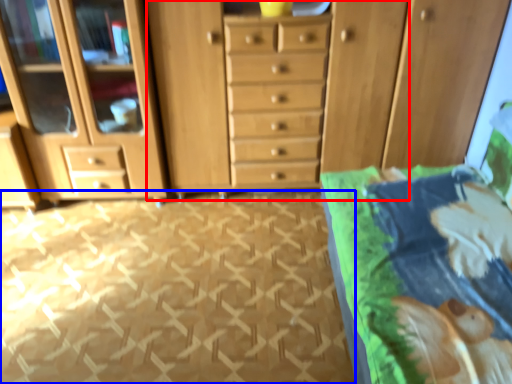
Question: Which point is closer to the camera, dresser (highlighted by a red box) or tile (highlighted by a blue box)?

Choices:
 (A) dresser
 (B) tile

Answer: (B)